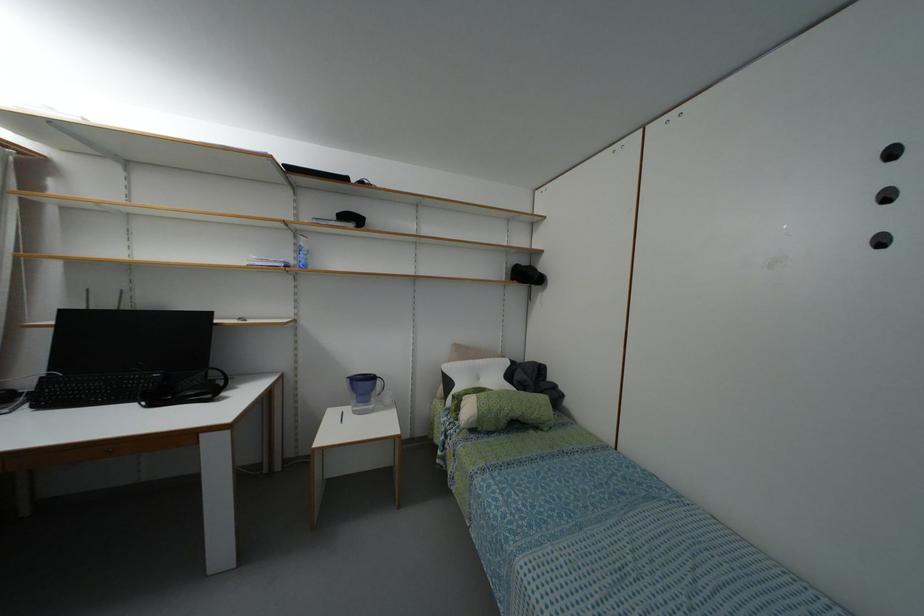
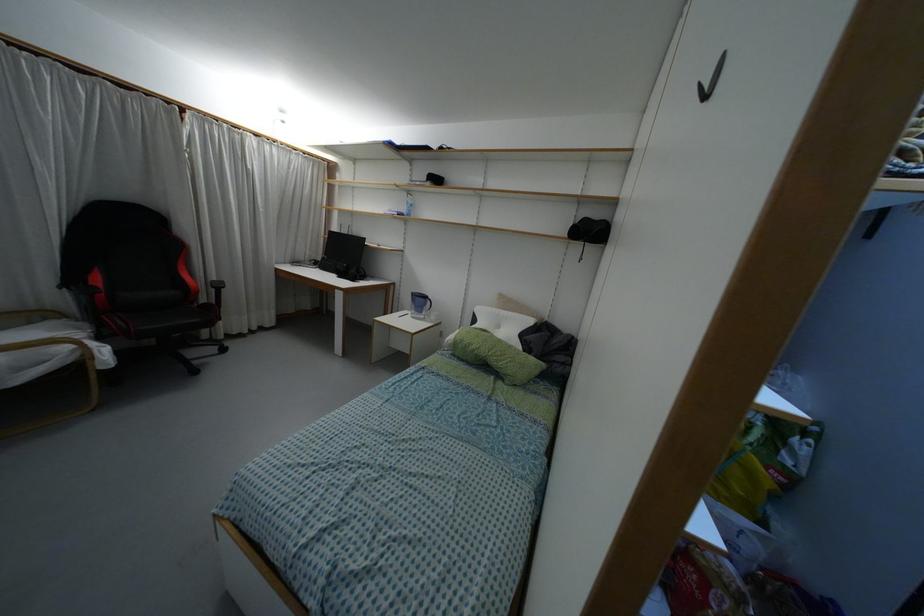
Find the pixel in the second image that matches [160,399] in the first image.

(341, 275)